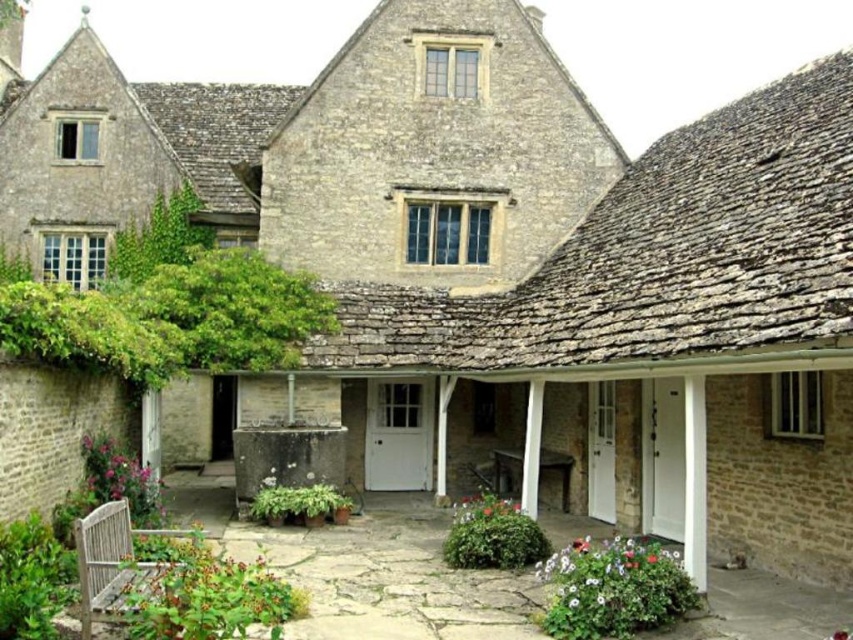
Can you confirm if green leafy plant at lower left is smaller than green leafy bush at center?

Actually, green leafy plant at lower left might be larger than green leafy bush at center.

Find the location of a particular element. green leafy plant at lower left is located at coordinates (209, 596).

Find the location of a particular element. The image size is (853, 640). green leafy plant at lower left is located at coordinates [x=209, y=596].

Is green leafy plant at lower left above green leafy bush at lower left?

No.

Is green leafy plant at lower left below green leafy bush at lower left?

Correct, green leafy plant at lower left is located below green leafy bush at lower left.

Is point (200, 616) positioned before point (36, 593)?

Yes, point (200, 616) is closer to viewer.

Find the location of a particular element. green leafy plant at lower left is located at coordinates (209, 596).

Between fluffy green bush at lower right and green leafy plant at lower left, which one appears on the left side from the viewer's perspective?

Positioned to the left is green leafy plant at lower left.

Between point (612, 625) and point (178, 576), which one is positioned behind?

The point (612, 625) is behind.

Find the location of a particular element. This screenshot has width=853, height=640. fluffy green bush at lower right is located at coordinates (613, 588).

Image resolution: width=853 pixels, height=640 pixels. In order to click on fluffy green bush at lower right in this screenshot , I will do [x=613, y=588].